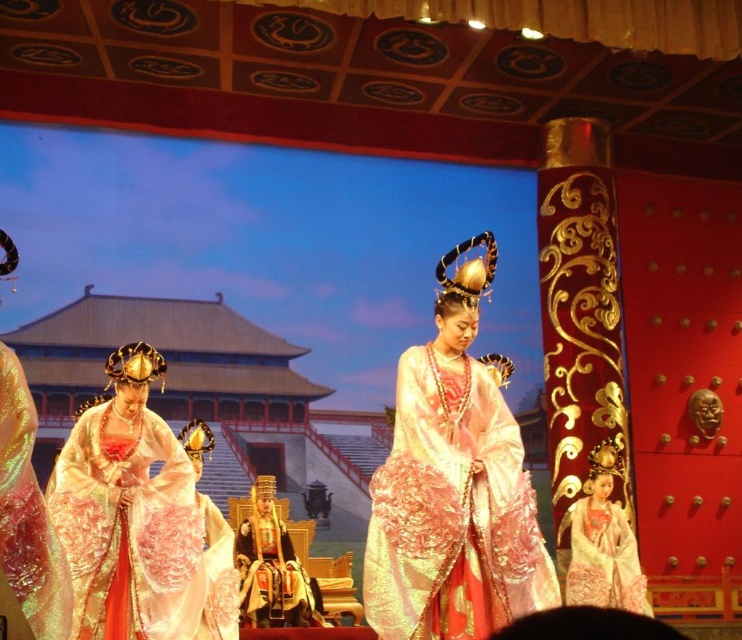
Looking at this image, is shiny gold dress at center shorter than silk embroidered robe at center?

No, shiny gold dress at center is not shorter than silk embroidered robe at center.

The height and width of the screenshot is (640, 742). Describe the element at coordinates (139, 518) in the screenshot. I see `shiny gold dress at center` at that location.

Find the location of a particular element. This screenshot has height=640, width=742. shiny gold dress at center is located at coordinates (139, 518).

Between shiny gold dress at center and silky white gown at center, which one appears on the left side from the viewer's perspective?

From the viewer's perspective, shiny gold dress at center appears more on the left side.

Does shiny gold dress at center have a larger size compared to silky white gown at center?

Correct, shiny gold dress at center is larger in size than silky white gown at center.

Who is more forward, (193, 552) or (597, 449)?

Point (193, 552) is more forward.

Where is `shiny gold dress at center`? The height and width of the screenshot is (640, 742). shiny gold dress at center is located at coordinates (139, 518).

Does silky pink gown at center have a lesser width compared to shiny gold dress at center?

Yes.

Is silky pink gown at center below shiny gold dress at center?

Incorrect, silky pink gown at center is not positioned below shiny gold dress at center.

What do you see at coordinates (453, 484) in the screenshot? The height and width of the screenshot is (640, 742). I see `silky pink gown at center` at bounding box center [453, 484].

Where is `silky pink gown at center`? silky pink gown at center is located at coordinates (453, 484).